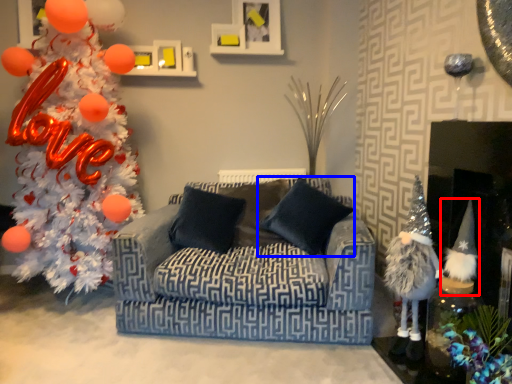
Question: Which point is closer to the camera, toy (highlighted by a red box) or pillow (highlighted by a blue box)?

Choices:
 (A) toy
 (B) pillow

Answer: (A)